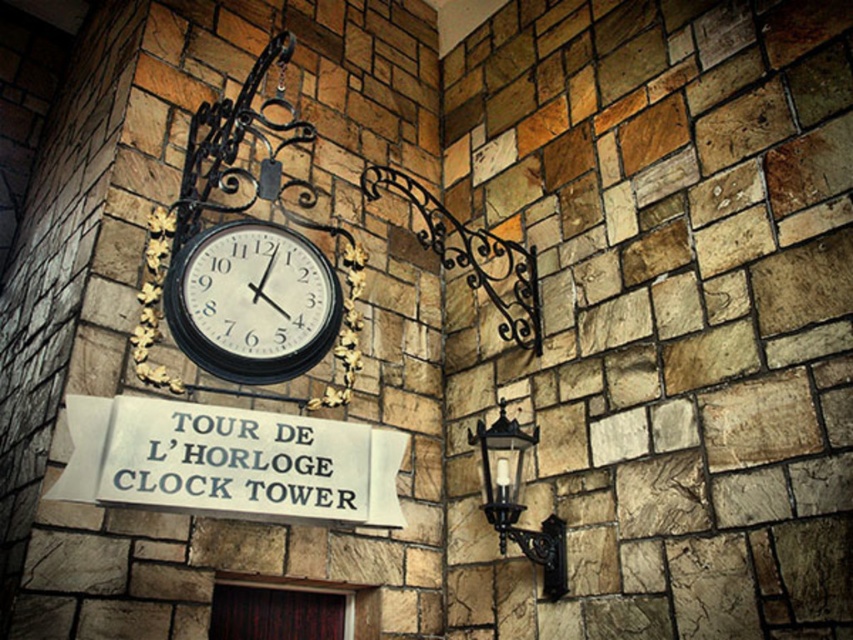
Question: Does black glossy clock at center appear on the right side of black wrought iron lamp at lower right?

Choices:
 (A) no
 (B) yes

Answer: (A)

Question: Observing the image, what is the correct spatial positioning of black glossy clock at center in reference to black wrought iron lamp at lower right?

Choices:
 (A) left
 (B) right

Answer: (A)

Question: Can you confirm if white metallic sign at center is positioned below black wrought iron lamp at lower right?

Choices:
 (A) yes
 (B) no

Answer: (B)

Question: Which object is closer to the camera taking this photo?

Choices:
 (A) black wrought iron lamp at lower right
 (B) black glossy clock at center
 (C) white metallic sign at center

Answer: (C)

Question: Which of the following is the closest to the observer?

Choices:
 (A) (560, 570)
 (B) (73, 468)
 (C) (248, 362)

Answer: (B)

Question: Which object appears closest to the camera in this image?

Choices:
 (A) black glossy clock at center
 (B) black wrought iron lamp at lower right
 (C) white metallic sign at center

Answer: (C)